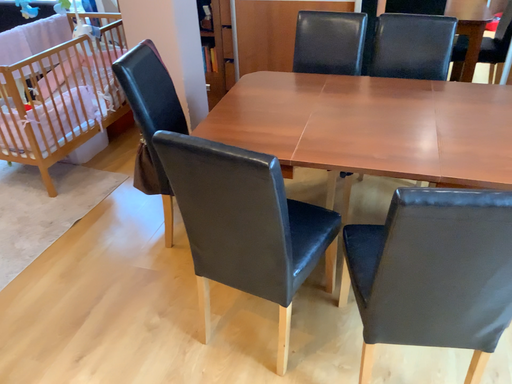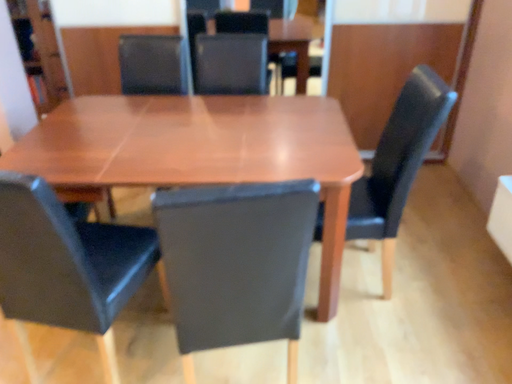
Question: Which way did the camera rotate in the video?

Choices:
 (A) rotated left
 (B) rotated right

Answer: (B)